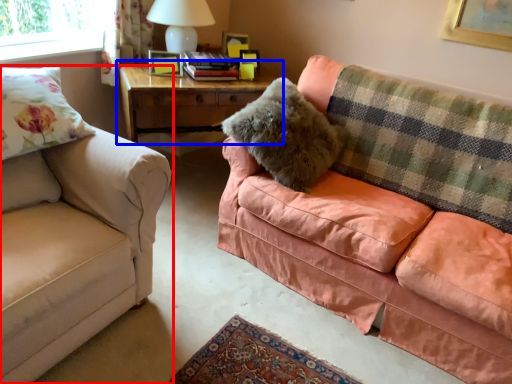
Question: Which of the following is the farthest to the observer, studio couch (highlighted by a red box) or table (highlighted by a blue box)?

Choices:
 (A) studio couch
 (B) table

Answer: (B)